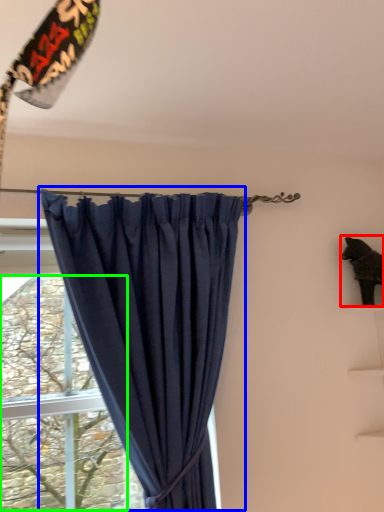
Question: Estimate the real-world distances between objects in this image. Which object is closer to animal (highlighted by a red box), curtain (highlighted by a blue box) or tree (highlighted by a green box)?

Choices:
 (A) curtain
 (B) tree

Answer: (A)